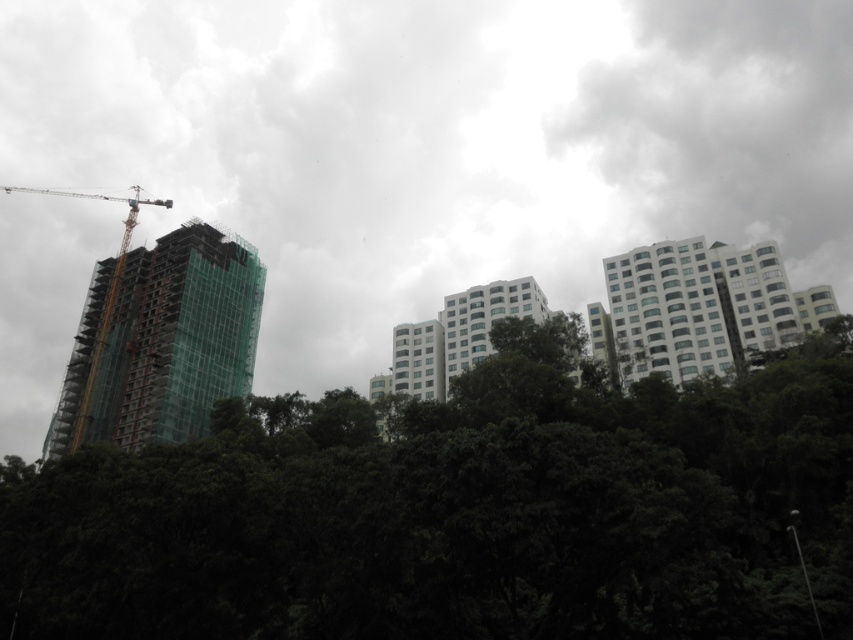
You are a drone operator trying to capture a photo of the green leafy trees at center and the green glass building at left. From your current position, which object would you need to adjust your camera angle upwards to focus on?

The green leafy trees at center are below the green glass building at left, so you would need to adjust your camera angle upwards to focus on the green glass building at left.

You are a city planner reviewing this urban landscape. You need to determine the location of the transparent glass building at upper left relative to other structures. Based on its coordinates, where is it positioned in the image?

The transparent glass building at upper left is located at point coordinates 0.225 on the horizontal axis and 0.516 on the vertical axis, placing it in the upper left quadrant of the image.

You are a city planner reviewing this urban scene. You need to determine the spatial relationship between the transparent glass building at upper left and the white glossy building at upper right. Which one is positioned higher in the image?

The transparent glass building at upper left is located above the white glossy building at upper right, so it is positioned higher in the image.